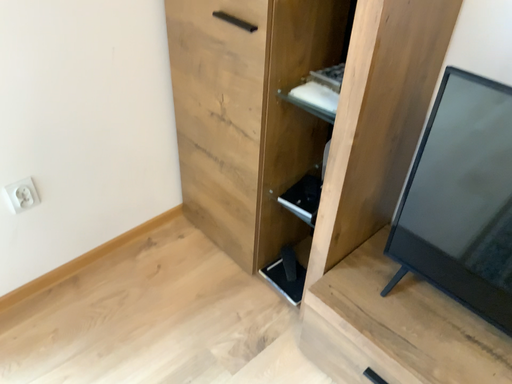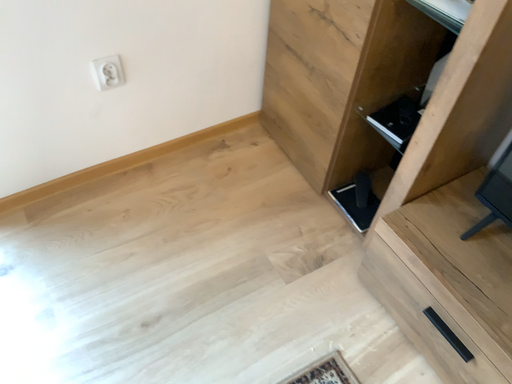
Question: How did the camera likely rotate when shooting the video?

Choices:
 (A) rotated downward
 (B) rotated upward

Answer: (A)